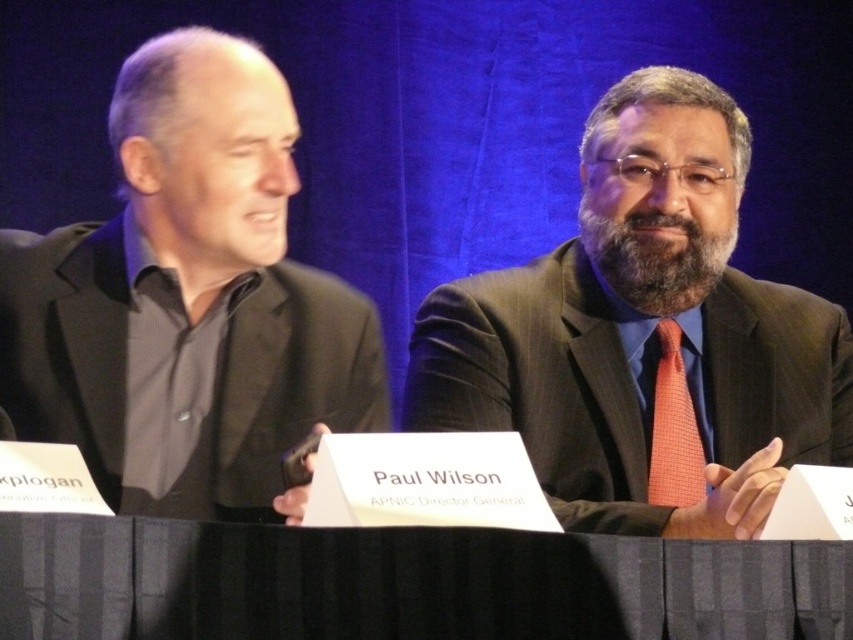
You are a photographer at a formal event and need to take a photo of the orange checkered tie at center. However, the black fabric table at center is blocking your view. Can you move the table to the side to get a clear shot?

The black fabric table at center is in front of the orange checkered tie at center, so moving the table to the side would allow you to see the orange checkered tie at center clearly.

Based on the scene description, what are the coordinates of the black matte suit at left?

The black matte suit at left is located at coordinates point (x=187, y=300).